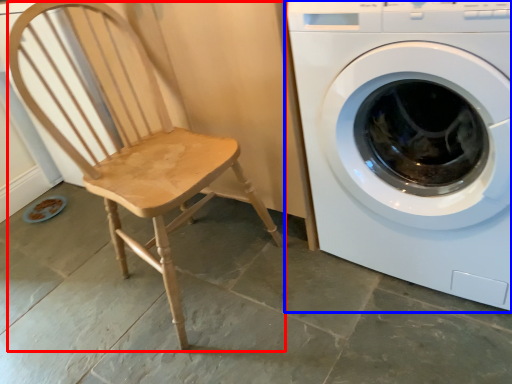
Question: Which object appears farthest to the camera in this image, rocking chair (highlighted by a red box) or washing machine (highlighted by a blue box)?

Choices:
 (A) rocking chair
 (B) washing machine

Answer: (A)